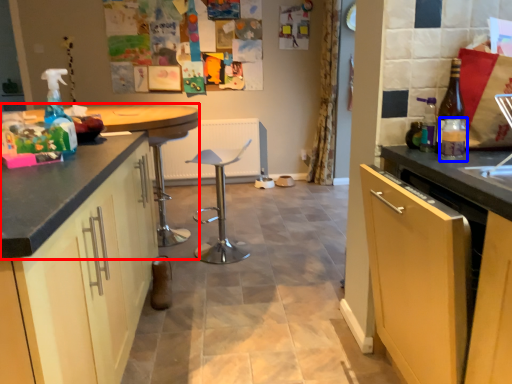
Question: Among these objects, which one is farthest to the camera, countertop (highlighted by a red box) or bottle (highlighted by a blue box)?

Choices:
 (A) countertop
 (B) bottle

Answer: (A)